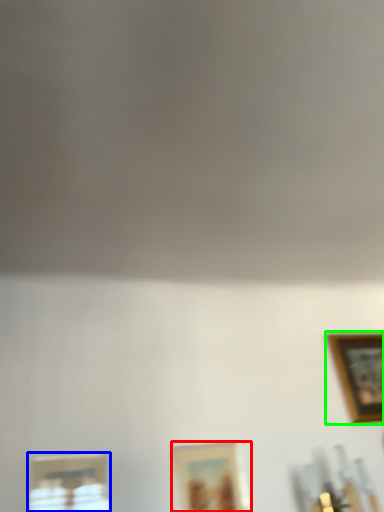
Question: Considering the real-world distances, which object is farthest from picture frame (highlighted by a red box)? picture frame (highlighted by a blue box) or picture frame (highlighted by a green box)?

Choices:
 (A) picture frame
 (B) picture frame

Answer: (B)